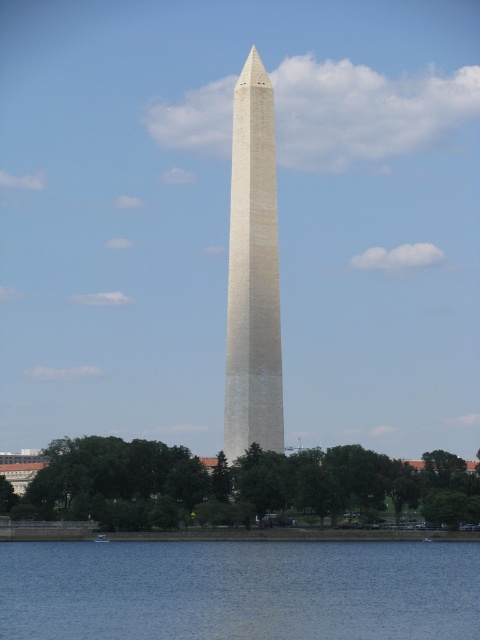
Question: Observing the image, what is the correct spatial positioning of green leafy tree at center in reference to white stone obelisk at center?

Choices:
 (A) above
 (B) below

Answer: (B)

Question: Does blue water at lower center appear under green leafy tree at center?

Choices:
 (A) no
 (B) yes

Answer: (B)

Question: Which point is farther to the camera?

Choices:
 (A) (432, 561)
 (B) (32, 481)

Answer: (B)

Question: Which object is positioned farthest from the green leafy tree at center?

Choices:
 (A) white stone obelisk at center
 (B) blue water at lower center

Answer: (A)

Question: Among these points, which one is farthest from the camera?

Choices:
 (A) (179, 609)
 (B) (238, 134)

Answer: (B)

Question: Can you confirm if blue water at lower center is thinner than green leafy tree at center?

Choices:
 (A) yes
 (B) no

Answer: (A)